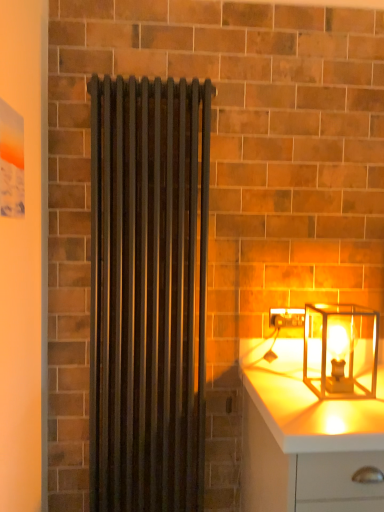
Question: Is the position of white glossy chest of drawers at lower right less distant than that of translucent glass lantern at right?

Choices:
 (A) no
 (B) yes

Answer: (B)

Question: Is white glossy chest of drawers at lower right next to translucent glass lantern at right and touching it?

Choices:
 (A) yes
 (B) no

Answer: (B)

Question: Can translucent glass lantern at right be found inside white glossy chest of drawers at lower right?

Choices:
 (A) yes
 (B) no

Answer: (B)

Question: Can you confirm if white glossy chest of drawers at lower right is smaller than translucent glass lantern at right?

Choices:
 (A) no
 (B) yes

Answer: (A)

Question: Is white glossy chest of drawers at lower right to the right of translucent glass lantern at right from the viewer's perspective?

Choices:
 (A) yes
 (B) no

Answer: (A)

Question: Considering the positions of translucent glass lantern at right and white glossy chest of drawers at lower right in the image, is translucent glass lantern at right taller or shorter than white glossy chest of drawers at lower right?

Choices:
 (A) tall
 (B) short

Answer: (B)

Question: Considering the relative positions of translucent glass lantern at right and white glossy chest of drawers at lower right in the image provided, is translucent glass lantern at right to the left or to the right of white glossy chest of drawers at lower right?

Choices:
 (A) left
 (B) right

Answer: (A)

Question: Does point (319, 306) appear closer or farther from the camera than point (271, 481)?

Choices:
 (A) farther
 (B) closer

Answer: (A)

Question: From a real-world perspective, relative to white glossy chest of drawers at lower right, is translucent glass lantern at right vertically above or below?

Choices:
 (A) above
 (B) below

Answer: (A)

Question: Looking at their shapes, would you say white glossy chest of drawers at lower right is wider or thinner than matte black radiator at center?

Choices:
 (A) wide
 (B) thin

Answer: (A)

Question: Which is correct: white glossy chest of drawers at lower right is inside matte black radiator at center, or outside of it?

Choices:
 (A) outside
 (B) inside

Answer: (A)

Question: Is point coord(258,386) closer or farther from the camera than point coord(201,325)?

Choices:
 (A) farther
 (B) closer

Answer: (B)

Question: From a real-world perspective, is white glossy chest of drawers at lower right positioned above or below matte black radiator at center?

Choices:
 (A) below
 (B) above

Answer: (A)

Question: From their relative heights in the image, would you say matte black radiator at center is taller or shorter than white glossy chest of drawers at lower right?

Choices:
 (A) tall
 (B) short

Answer: (A)

Question: From a real-world perspective, is matte black radiator at center above or below white glossy chest of drawers at lower right?

Choices:
 (A) below
 (B) above

Answer: (B)